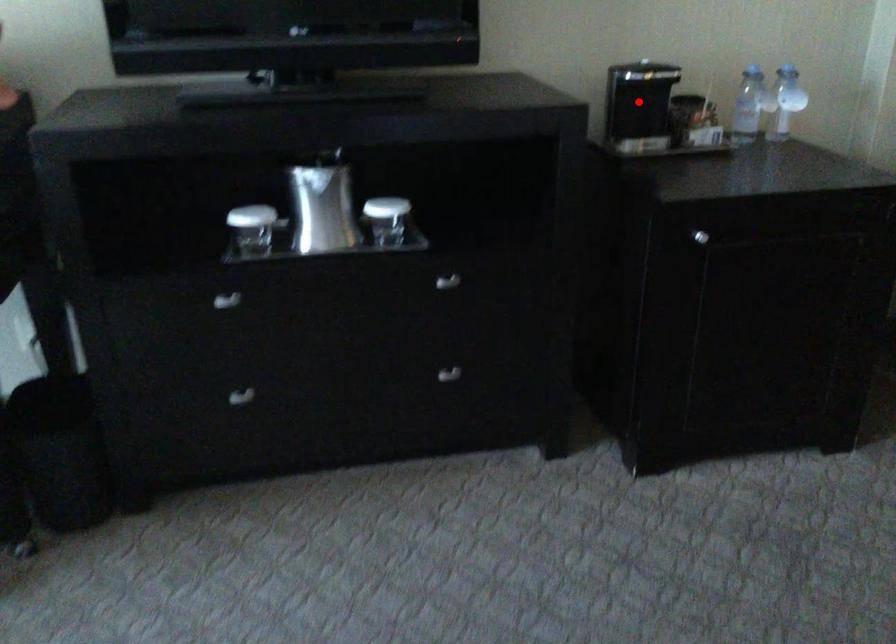
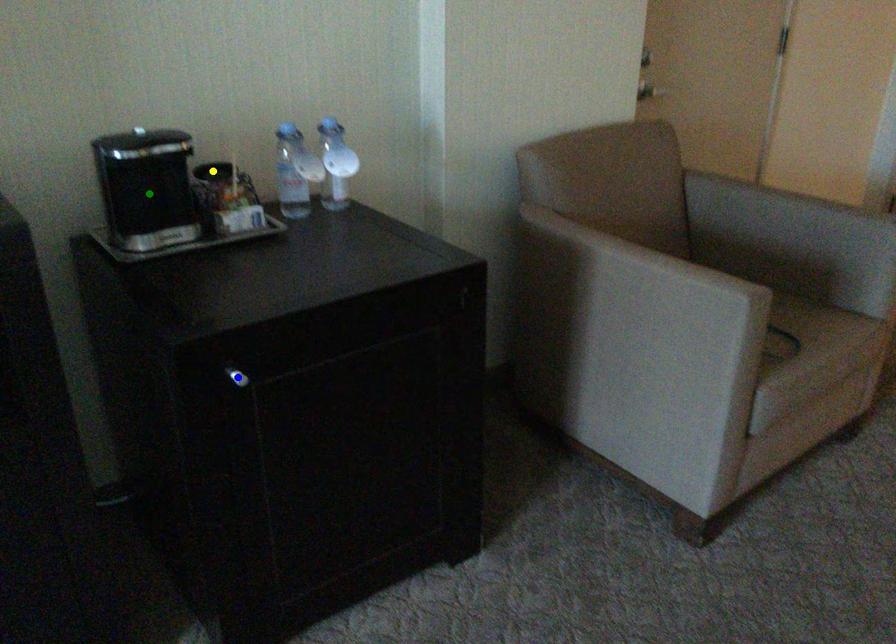
Question: I am providing you with two images of the same scene from different viewpoints. A red point is marked on the first image. You are given multiple points on the second image. Which point in image 2 is actually the same real-world point as the red point in image 1?

Choices:
 (A) yellow point
 (B) green point
 (C) blue point

Answer: (B)